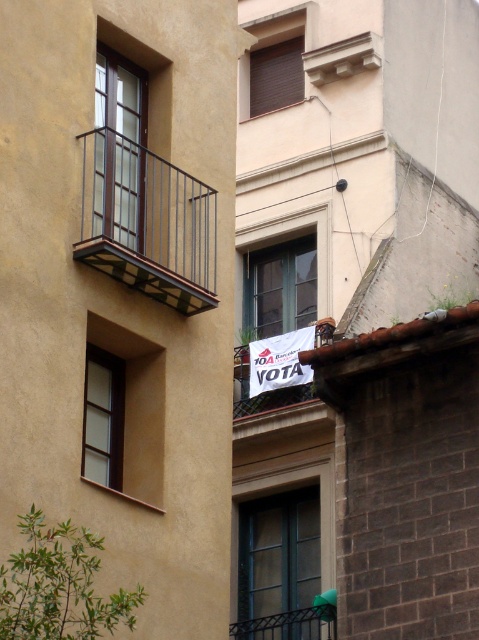
Question: Which object is closer to the camera taking this photo?

Choices:
 (A) matte glass window at center
 (B) matte glass window at lower left
 (C) smooth stone balcony at upper center
 (D) brown matte window at upper center

Answer: (B)

Question: Which point is closer to the camera?

Choices:
 (A) matte glass window at lower left
 (B) smooth stone balcony at upper center
 (C) matte glass window at left

Answer: (C)

Question: Is clear glass window at upper left above matte glass window at lower left?

Choices:
 (A) yes
 (B) no

Answer: (A)

Question: Does matte glass window at center appear on the right side of matte glass window at lower left?

Choices:
 (A) no
 (B) yes

Answer: (B)

Question: Which object is the farthest from the smooth stone balcony at upper center?

Choices:
 (A) matte glass window at left
 (B) clear glass window at center

Answer: (A)

Question: Is clear glass window at upper left to the left of brown matte window at upper center from the viewer's perspective?

Choices:
 (A) yes
 (B) no

Answer: (A)